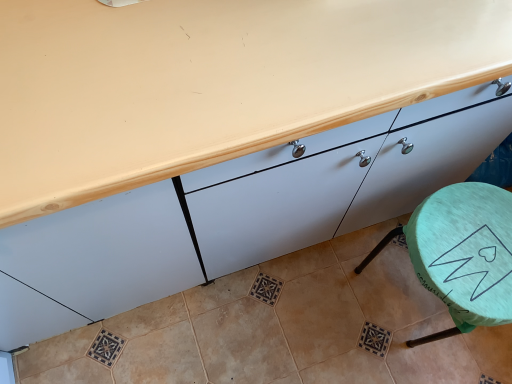
This screenshot has height=384, width=512. Identify the location of free space above green fabric stool at lower right (from a real-world perspective). (473, 243).